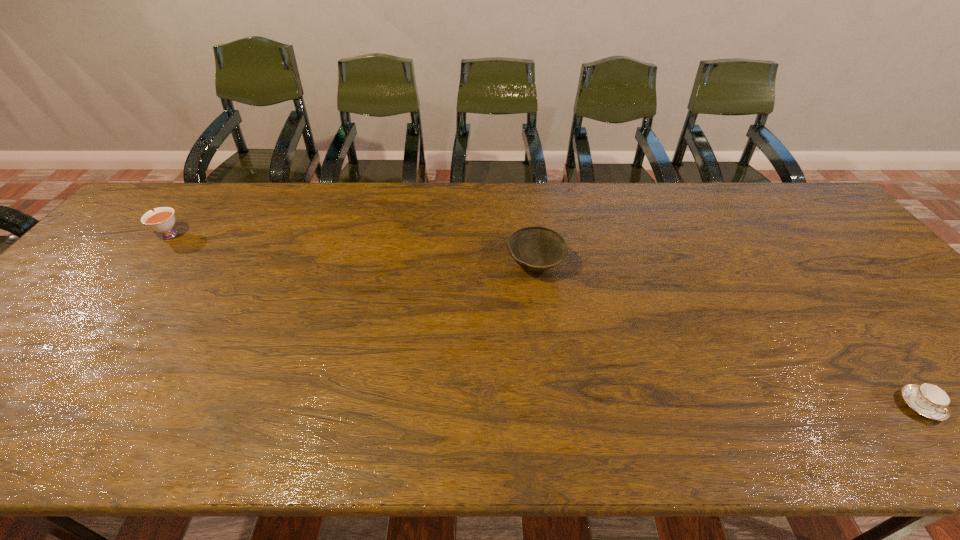
The image size is (960, 540). I want to click on empty location between the second nearest object and the leftmost object, so click(x=351, y=250).

Where is `free space between the rightmost object and the leftmost object`? free space between the rightmost object and the leftmost object is located at coordinates (544, 320).

Locate an element on the screen. The height and width of the screenshot is (540, 960). free spot between the nearest object and the taller teacup is located at coordinates (544, 320).

Identify the location of empty space between the farthest object and the bowl. The height and width of the screenshot is (540, 960). (351, 250).

The height and width of the screenshot is (540, 960). Identify the location of unoccupied position between the leftmost object and the rightmost object. (544, 320).

Where is `free area in between the rightmost object and the leftmost object`? free area in between the rightmost object and the leftmost object is located at coordinates (544, 320).

Identify which object is located as the second nearest to the right teacup. Please provide its 2D coordinates. Your answer should be formatted as a tuple, i.e. [(x, y)], where the tuple contains the x and y coordinates of a point satisfying the conditions above.

[(162, 220)]

You are a GUI agent. You are given a task and a screenshot of the screen. Output one action in this format:
    pyautogui.click(x=<x>, y=<y>)
    Task: Click on the object that is the second closest one to the taller teacup
    
    Given the screenshot: What is the action you would take?
    pyautogui.click(x=928, y=400)

Locate an element on the screen. This screenshot has width=960, height=540. vacant area that satisfies the following two spatial constraints: 1. on the back side of the second object from right to left; 2. on the side of the farthest object with the handle is located at coordinates (531, 235).

Find the location of a particular element. The image size is (960, 540). vacant region that satisfies the following two spatial constraints: 1. on the side of the left teacup with the handle; 2. on the left side of the second farthest object is located at coordinates (143, 265).